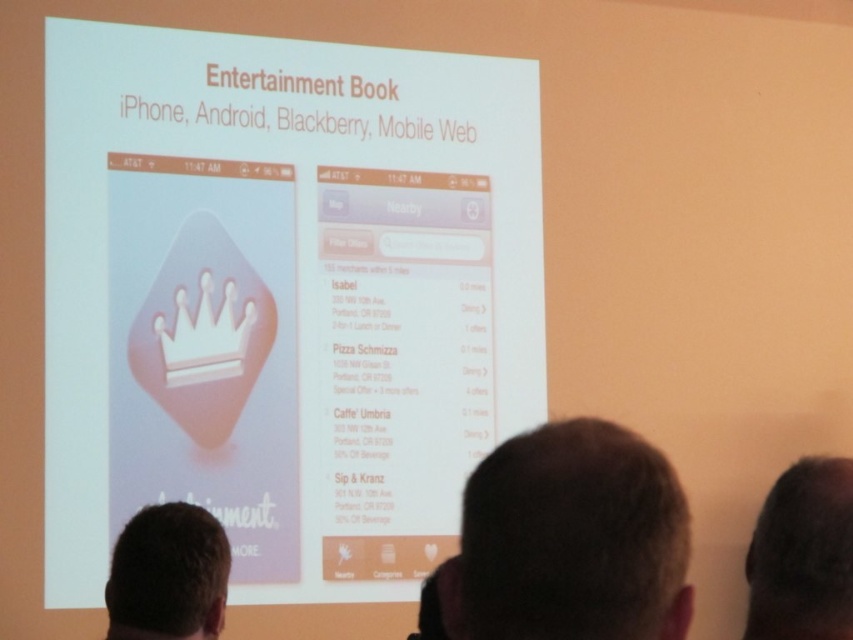
Question: Which of these objects is positioned closest to the white glossy screen at center?

Choices:
 (A) dark brown hair at upper right
 (B) brown hair at lower left

Answer: (B)

Question: Which point appears closest to the camera in this image?

Choices:
 (A) (146, 552)
 (B) (614, 477)
 (C) (251, 460)
 (D) (836, 544)

Answer: (B)

Question: Can you confirm if dark brown hair at upper right is positioned below brown hair at lower left?

Choices:
 (A) yes
 (B) no

Answer: (B)

Question: Is dark brown hair at lower center smaller than dark brown hair at upper right?

Choices:
 (A) no
 (B) yes

Answer: (A)

Question: Which point is farther to the camera?

Choices:
 (A) dark brown hair at lower center
 (B) brown hair at lower left
 (C) white glossy screen at center
 (D) dark brown hair at upper right

Answer: (C)

Question: Is dark brown hair at lower center thinner than brown hair at lower left?

Choices:
 (A) no
 (B) yes

Answer: (A)